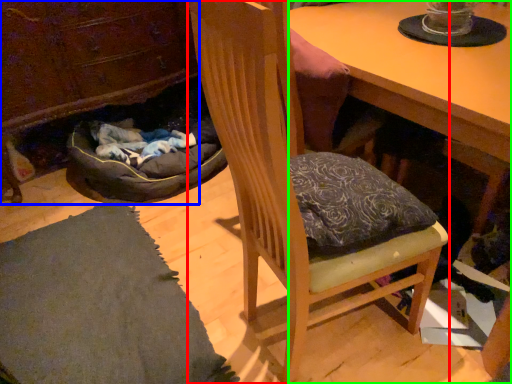
Question: Which object is positioned closest to chair (highlighted by a red box)? Select from cabinetry (highlighted by a blue box) and desk (highlighted by a green box).

Choices:
 (A) cabinetry
 (B) desk

Answer: (B)